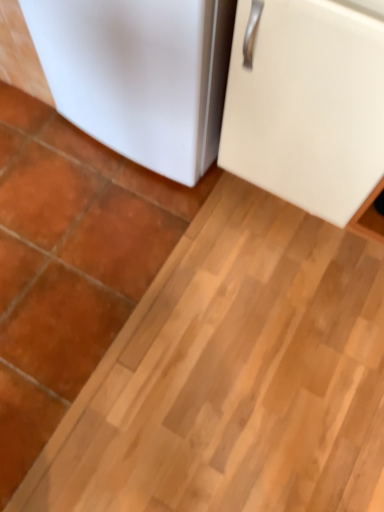
Question: Is white matte cabinet at upper right, which appears as the 2th refrigerator when viewed from the left, to the left or to the right of white matte refrigerator at lower left, the 1th refrigerator from the left, in the image?

Choices:
 (A) right
 (B) left

Answer: (A)

Question: Is white matte cabinet at upper right, marked as the 1th refrigerator in a right-to-left arrangement, bigger or smaller than white matte refrigerator at lower left, positioned as the 2th refrigerator in right-to-left order?

Choices:
 (A) small
 (B) big

Answer: (B)

Question: From the image's perspective, relative to white matte refrigerator at lower left, positioned as the 2th refrigerator in right-to-left order, is white matte cabinet at upper right, marked as the 1th refrigerator in a right-to-left arrangement, above or below?

Choices:
 (A) below
 (B) above

Answer: (A)

Question: Considering the relative positions of white matte refrigerator at lower left, the 1th refrigerator from the left, and white matte cabinet at upper right, which appears as the 2th refrigerator when viewed from the left, in the image provided, is white matte refrigerator at lower left, the 1th refrigerator from the left, to the left or to the right of white matte cabinet at upper right, which appears as the 2th refrigerator when viewed from the left,?

Choices:
 (A) left
 (B) right

Answer: (A)

Question: In the image, is white matte refrigerator at lower left, positioned as the 2th refrigerator in right-to-left order, positioned in front of or behind white matte cabinet at upper right, marked as the 1th refrigerator in a right-to-left arrangement?

Choices:
 (A) behind
 (B) front

Answer: (A)

Question: Is white matte refrigerator at lower left, positioned as the 2th refrigerator in right-to-left order, taller or shorter than white matte cabinet at upper right, marked as the 1th refrigerator in a right-to-left arrangement?

Choices:
 (A) tall
 (B) short

Answer: (B)

Question: Is white matte refrigerator at lower left, positioned as the 2th refrigerator in right-to-left order, bigger or smaller than white matte cabinet at upper right, which appears as the 2th refrigerator when viewed from the left?

Choices:
 (A) small
 (B) big

Answer: (A)